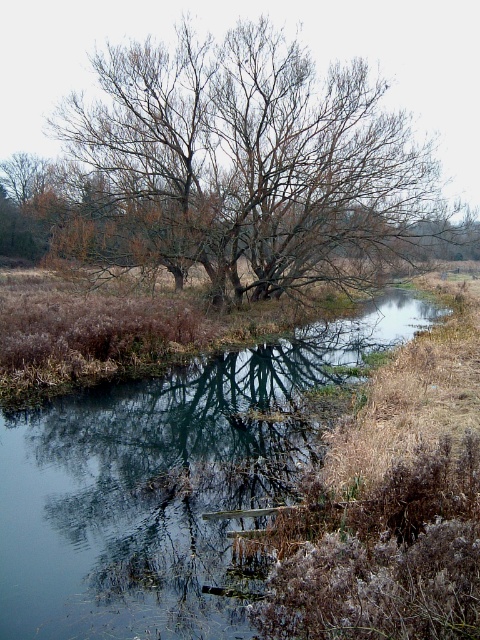
Question: Where is smooth reflective water at center located in relation to bare branches tree at center in the image?

Choices:
 (A) above
 (B) below

Answer: (B)

Question: Which object is farther from the camera taking this photo?

Choices:
 (A) smooth reflective water at center
 (B) bare branches tree at center

Answer: (B)

Question: In this image, where is smooth reflective water at center located relative to bare branches tree at center?

Choices:
 (A) above
 (B) below

Answer: (B)

Question: Does smooth reflective water at center appear over bare branches tree at center?

Choices:
 (A) no
 (B) yes

Answer: (A)

Question: Among these objects, which one is nearest to the camera?

Choices:
 (A) bare branches tree at center
 (B) smooth reflective water at center

Answer: (B)